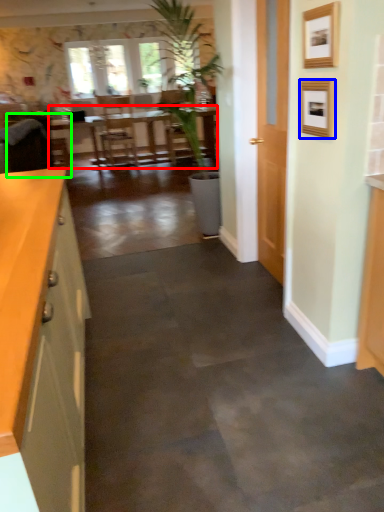
Question: Which is farther away from table (highlighted by a red box)? picture frame (highlighted by a blue box) or armchair (highlighted by a green box)?

Choices:
 (A) picture frame
 (B) armchair

Answer: (A)